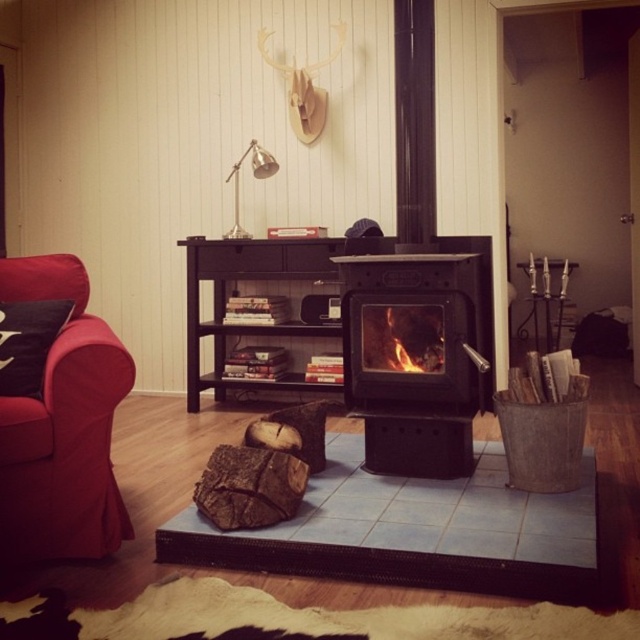
Which is more to the right, matte red armchair at left or flaming wood at center?

flaming wood at center

Can you confirm if matte red armchair at left is positioned to the right of flaming wood at center?

In fact, matte red armchair at left is to the left of flaming wood at center.

Does point (68, 273) come closer to viewer compared to point (384, 324)?

Yes, it is.

Where is `matte red armchair at left`? This screenshot has width=640, height=640. matte red armchair at left is located at coordinates (61, 428).

Between brown rough wood at center and flaming wood at center, which one has less height?

brown rough wood at center is shorter.

Can you confirm if brown rough wood at center is bigger than flaming wood at center?

Yes.

Describe the element at coordinates (250, 486) in the screenshot. I see `brown rough wood at center` at that location.

The height and width of the screenshot is (640, 640). Identify the location of brown rough wood at center. (250, 486).

Is black cast iron fireplace at center shorter than brown rough wood at center?

Incorrect, black cast iron fireplace at center's height does not fall short of brown rough wood at center's.

Is point (464, 257) positioned behind point (252, 502)?

That is True.

In order to click on black cast iron fireplace at center in this screenshot , I will do `click(412, 358)`.